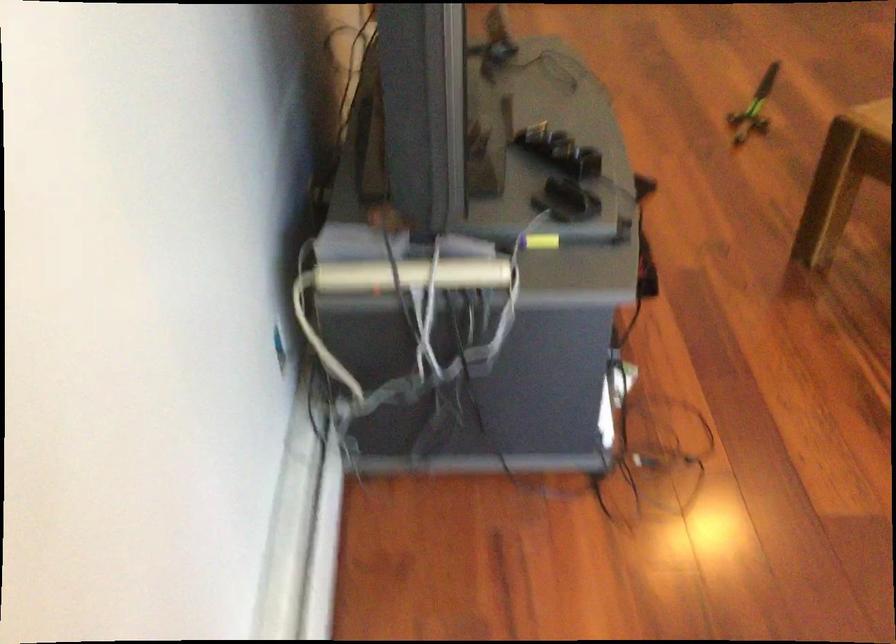
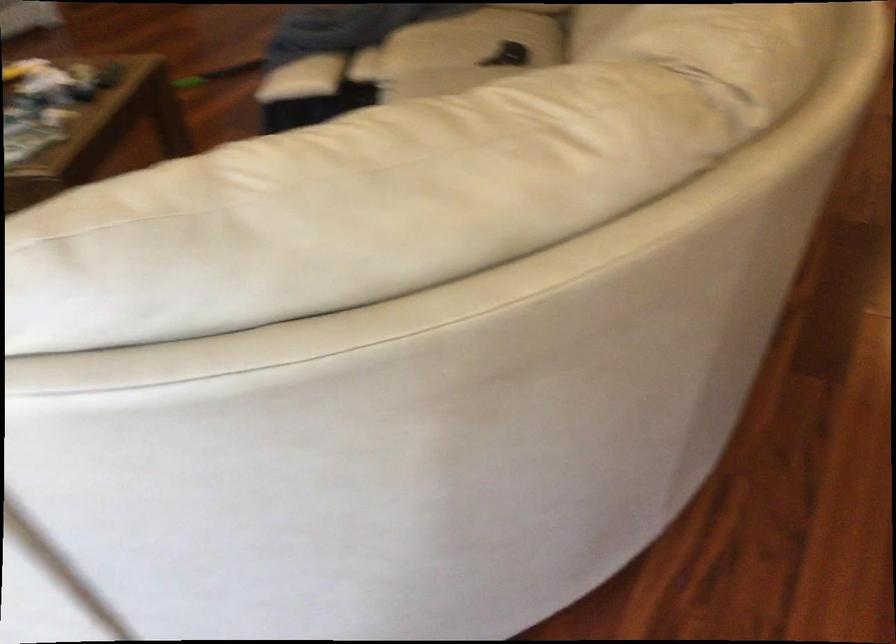
Question: Which direction would the cameraman need to move to produce the second image? Reply with the corresponding letter.

Choices:
 (A) Left
 (B) Right
 (C) Forward
 (D) Backward

Answer: (B)